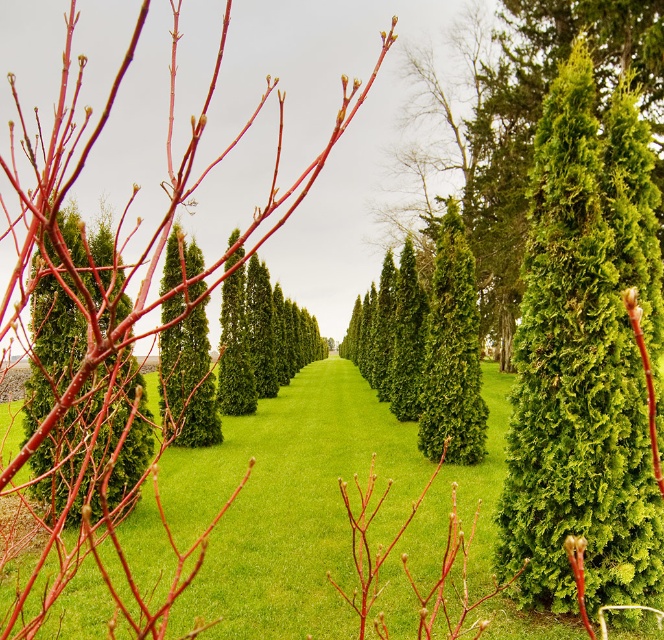
Question: Where is green grass at center located in relation to green fuzzy shrub at right in the image?

Choices:
 (A) left
 (B) right

Answer: (A)

Question: Which is farther from the green textured shrub at center?

Choices:
 (A) green fuzzy shrub at right
 (B) matte red shrub at left
 (C) green grass at center

Answer: (A)

Question: Which object is the closest to the matte red shrub at left?

Choices:
 (A) green grass at center
 (B) green textured shrub at center
 (C) green fuzzy shrub at right

Answer: (A)

Question: Which point appears closest to the camera in this image?

Choices:
 (A) (56, 424)
 (B) (604, 580)
 (C) (159, 392)
 (D) (5, 419)

Answer: (A)

Question: Is green grass at center to the right of green fuzzy shrub at right from the viewer's perspective?

Choices:
 (A) no
 (B) yes

Answer: (A)

Question: Considering the relative positions of green fuzzy shrub at right and matte red shrub at left in the image provided, where is green fuzzy shrub at right located with respect to matte red shrub at left?

Choices:
 (A) right
 (B) left

Answer: (A)